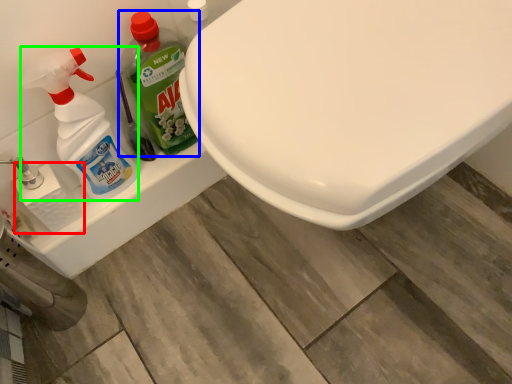
Question: Which object is the closest to the toilet paper (highlighted by a red box)? Choose among these: cleaning product (highlighted by a blue box) or cleaning product (highlighted by a green box).

Choices:
 (A) cleaning product
 (B) cleaning product

Answer: (B)